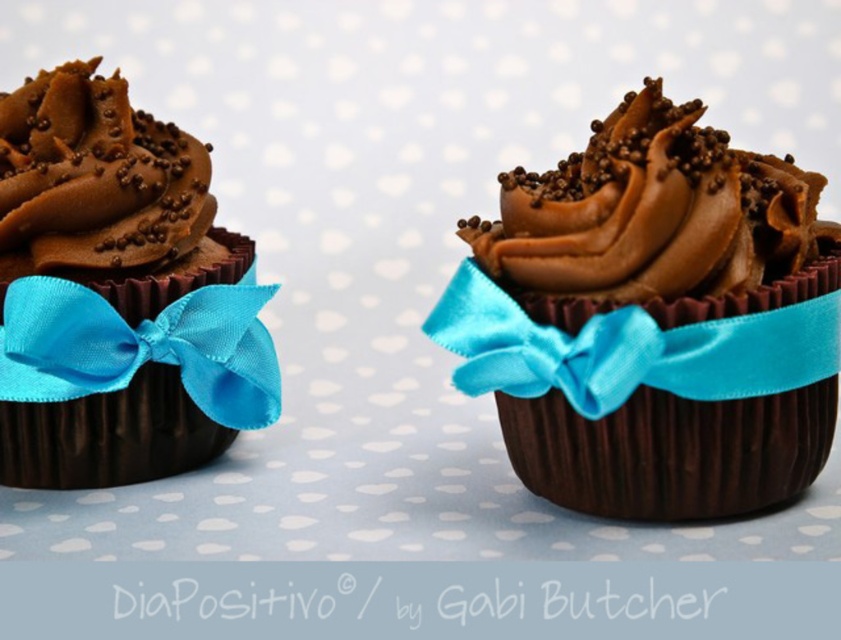
Is chocolatesmoothcupcake at left thinner than turquoise satin ribbon at left?

Yes, chocolatesmoothcupcake at left is thinner than turquoise satin ribbon at left.

Can you confirm if chocolatesmoothcupcake at left is wider than turquoise satin ribbon at left?

Incorrect, chocolatesmoothcupcake at left's width does not surpass turquoise satin ribbon at left's.

Who is more forward, (115, 70) or (50, 323)?

Point (50, 323) is in front.

Locate an element on the screen. chocolatesmoothcupcake at left is located at coordinates (94, 177).

Does matte chocolate cupcake at center lie behind chocolatesmoothcupcake at right?

That is False.

Which is more to the left, matte chocolate cupcake at center or chocolatesmoothcupcake at right?

Positioned to the left is matte chocolate cupcake at center.

Describe the element at coordinates (654, 321) in the screenshot. The width and height of the screenshot is (841, 640). I see `matte chocolate cupcake at center` at that location.

Image resolution: width=841 pixels, height=640 pixels. Identify the location of matte chocolate cupcake at center. (654, 321).

How distant is chocolatesmoothcupcake at right from turquoise satin ribbon at left?

The distance of chocolatesmoothcupcake at right from turquoise satin ribbon at left is 13.17 inches.

Which is more to the right, chocolatesmoothcupcake at right or turquoise satin ribbon at left?

chocolatesmoothcupcake at right is more to the right.

Is point (696, 214) positioned after point (136, 358)?

No, (696, 214) is closer to viewer.

The width and height of the screenshot is (841, 640). Identify the location of chocolatesmoothcupcake at right. (652, 212).